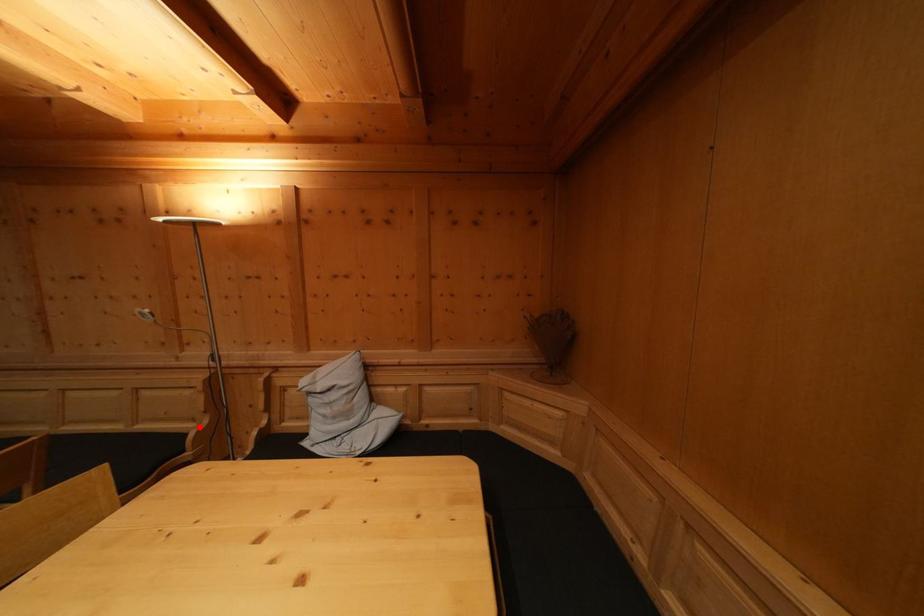
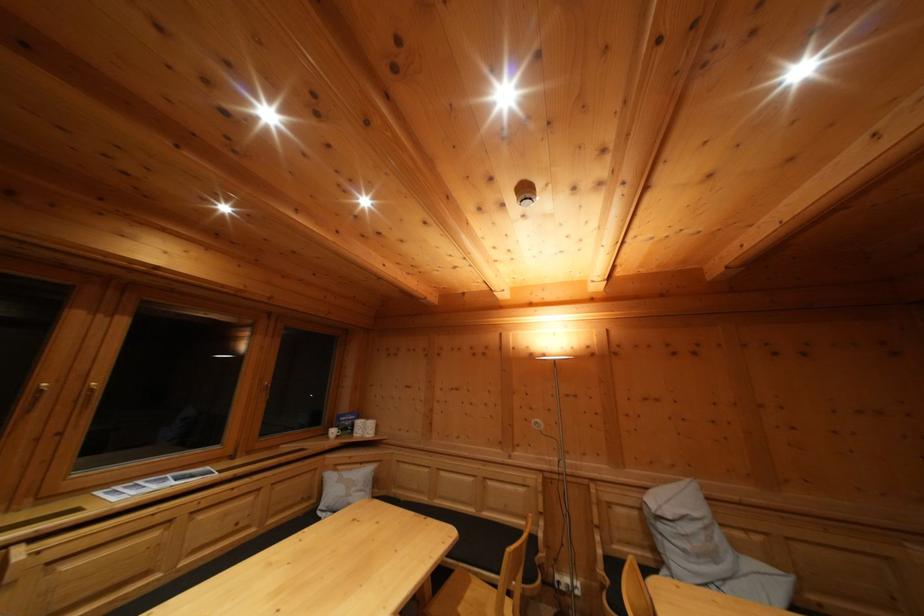
Question: I am providing you with two images of the same scene from different viewpoints. A red point is marked on the first image. At the location where the point appears in image 1, is it still visible in image 2?

Choices:
 (A) Yes
 (B) No

Answer: (A)